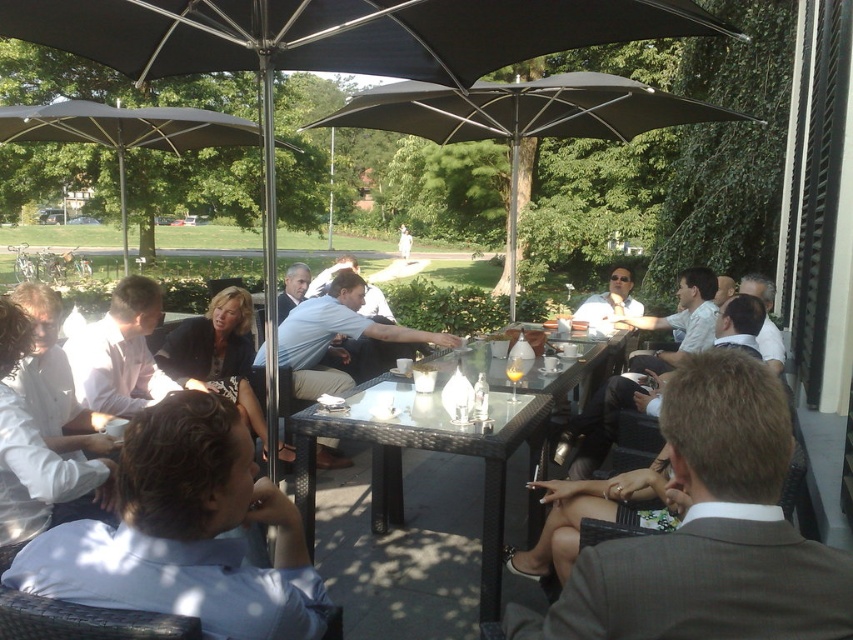
Question: Which object appears farthest from the camera in this image?

Choices:
 (A) white shirt at left
 (B) translucent glass cup at center
 (C) dark gray fabric umbrella at upper left
 (D) black fabric umbrella at center

Answer: (D)

Question: Estimate the real-world distances between objects in this image. Which object is closer to the dark gray fabric umbrella at upper left?

Choices:
 (A) white shirt at left
 (B) white shirt at center
 (C) black fabric umbrella at center
 (D) translucent glass cup at center

Answer: (C)

Question: Observing the image, what is the correct spatial positioning of white shirt at left in reference to dark gray fabric umbrella at upper left?

Choices:
 (A) above
 (B) below

Answer: (B)

Question: Which of these objects is positioned farthest from the black fabric umbrella at center?

Choices:
 (A) white shirt at left
 (B) brown leather jacket at center
 (C) translucent glass cup at center
 (D) dark gray fabric umbrella at upper left

Answer: (B)

Question: Can you confirm if transparent glass table at center is smaller than white shirt at left?

Choices:
 (A) no
 (B) yes

Answer: (A)

Question: Is black fabric umbrella at center positioned in front of translucent glass cup at center?

Choices:
 (A) no
 (B) yes

Answer: (A)